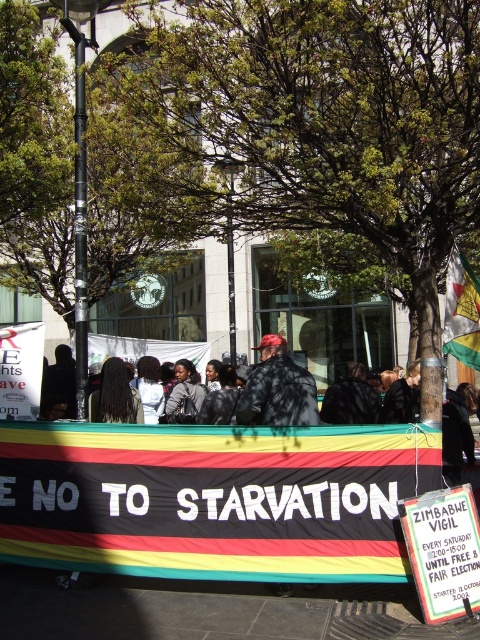
Can you confirm if black fabric banner at center is shorter than long black hair at center?

In fact, black fabric banner at center may be taller than long black hair at center.

Describe the element at coordinates (213, 499) in the screenshot. This screenshot has height=640, width=480. I see `black fabric banner at center` at that location.

Where is `black fabric banner at center`? black fabric banner at center is located at coordinates (213, 499).

Looking at this image, is matte black jacket at center below yellow-green fabric flag at center-right?

Yes, matte black jacket at center is below yellow-green fabric flag at center-right.

Is matte black jacket at center thinner than yellow-green fabric flag at center-right?

No, matte black jacket at center is not thinner than yellow-green fabric flag at center-right.

Between point (275, 346) and point (463, 317), which one is positioned behind?

The point (463, 317) is more distant.

Where is `matte black jacket at center`? matte black jacket at center is located at coordinates (277, 388).

Who is more distant from viewer, [402,560] or [456,355]?

The point [456,355] is more distant.

Who is higher up, black fabric banner at center or yellow-green fabric flag at center-right?

yellow-green fabric flag at center-right is above.

Who is more forward, (322, 561) or (465, 337)?

Positioned in front is point (322, 561).

This screenshot has height=640, width=480. I want to click on black fabric banner at center, so click(213, 499).